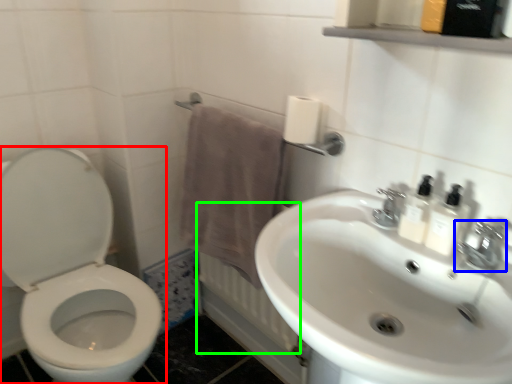
Question: Which is farther away from toilet (highlighted by a red box)? tap (highlighted by a blue box) or radiator (highlighted by a green box)?

Choices:
 (A) tap
 (B) radiator

Answer: (A)